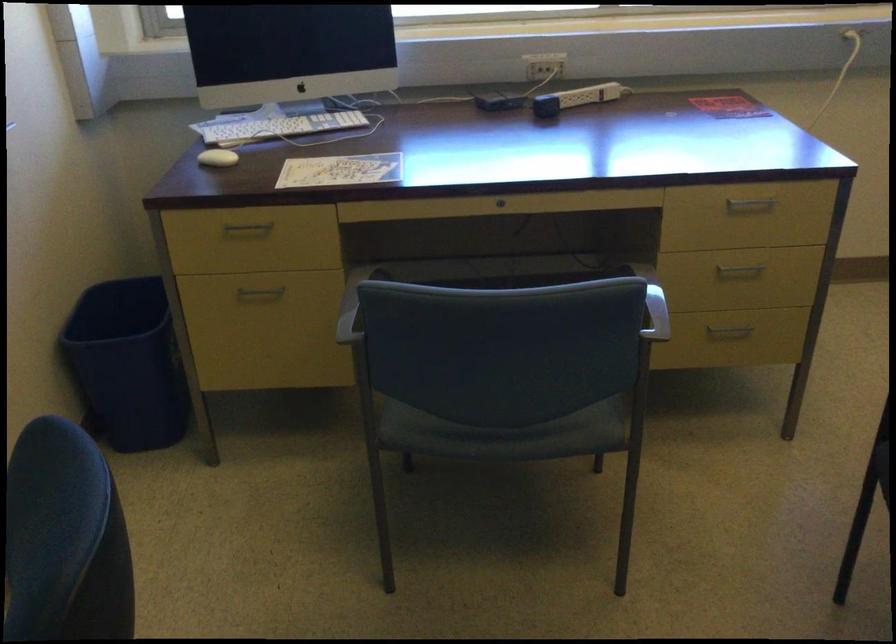
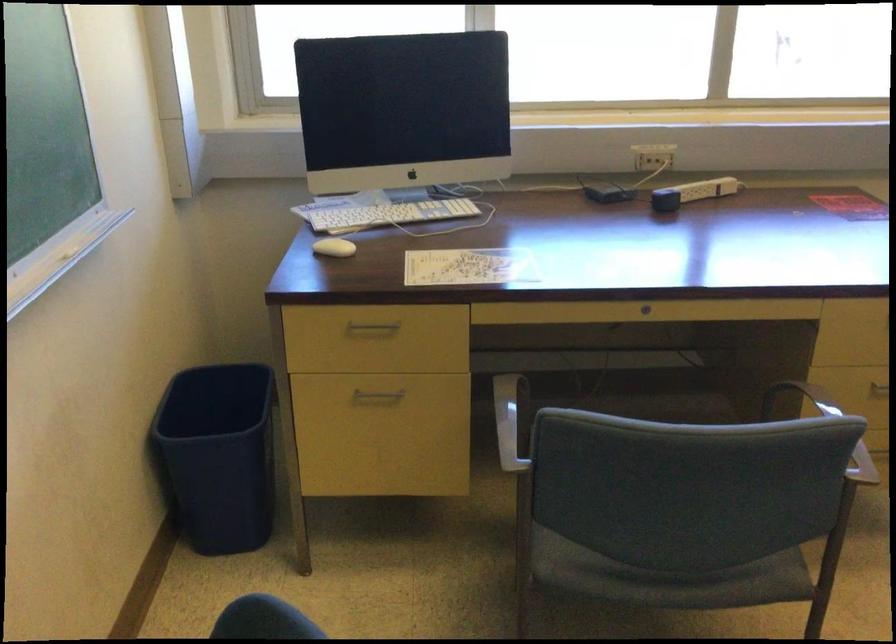
The point at (546, 108) is marked in the first image. Where is the corresponding point in the second image?

(665, 200)